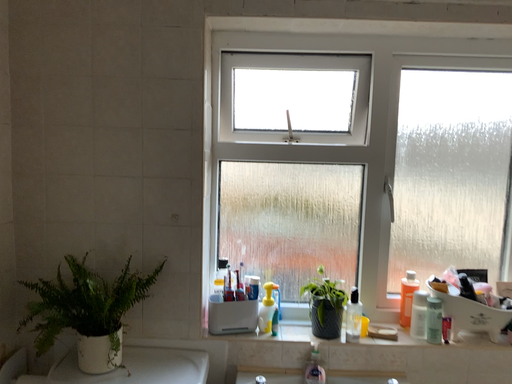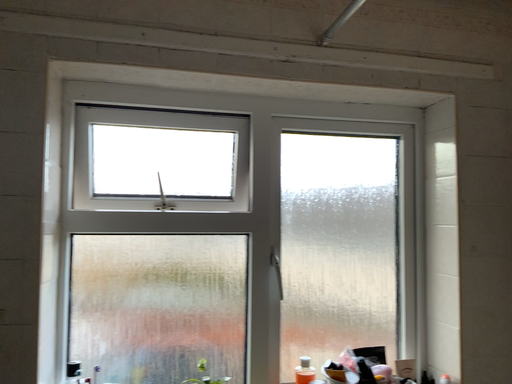
Question: Which way did the camera rotate in the video?

Choices:
 (A) rotated right
 (B) rotated left

Answer: (A)